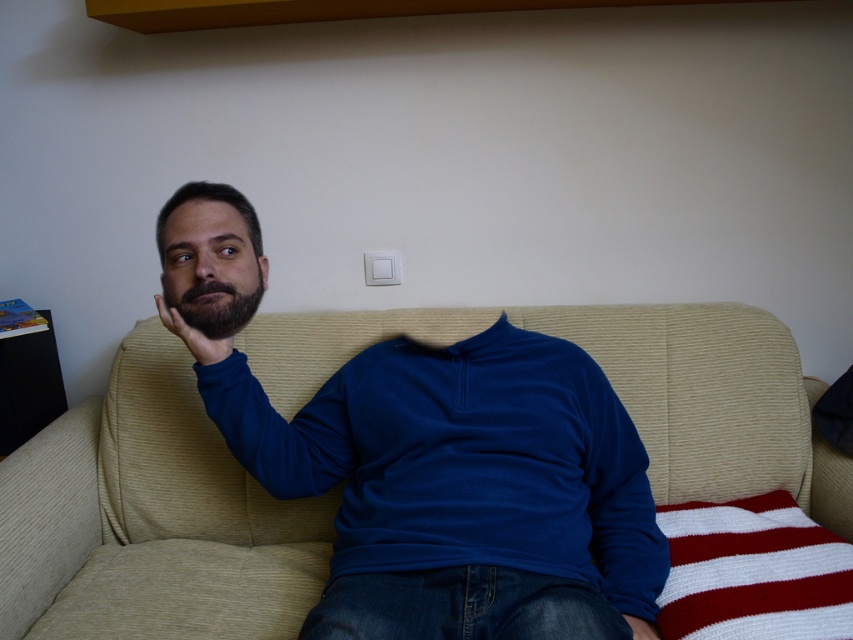
You are designing a new living room layout and want to place a rectangular coffee table between the beige corduroy couch at center and the blue cotton shirt at center. Considering their heights, which object should be placed closer to the ceiling to ensure the table fits properly?

The blue cotton shirt at center is taller than the beige corduroy couch at center, so the blue cotton shirt at center should be placed closer to the ceiling to ensure the table fits properly.